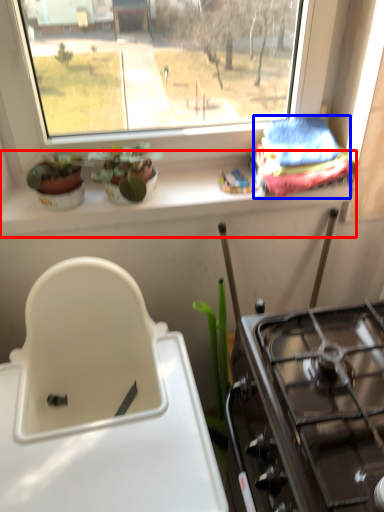
Question: Which object appears farthest to the camera in this image, window sill (highlighted by a red box) or material (highlighted by a blue box)?

Choices:
 (A) window sill
 (B) material

Answer: (A)